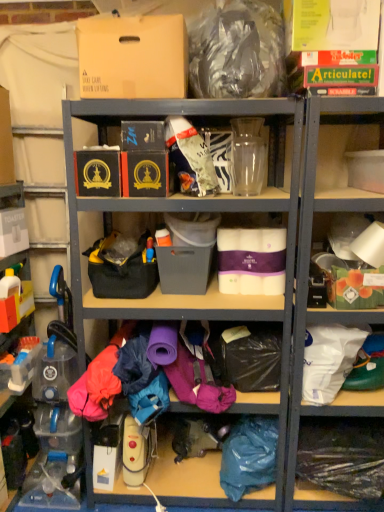
Question: Relative to clear plastic bottles at left, which is counted as the 1th shelf, starting from the left, is matte plastic storage box at center, the third storage box in the right-to-left sequence, in front or behind?

Choices:
 (A) front
 (B) behind

Answer: (B)

Question: Considering the positions of matte plastic storage box at center, the third storage box in the right-to-left sequence, and clear plastic bottles at left, acting as the fifth shelf starting from the right, in the image, is matte plastic storage box at center, the third storage box in the right-to-left sequence, wider or thinner than clear plastic bottles at left, acting as the fifth shelf starting from the right,?

Choices:
 (A) thin
 (B) wide

Answer: (B)

Question: Which object is positioned closest to the matte cardboard box at upper left, the 5th storage box viewed from the right?

Choices:
 (A) clear plastic bottle at lower left, the 2th shelf from the left
 (B) white plastic toaster at left, arranged as the 1th storage box when viewed from the left
 (C) clear plastic bottles at left, which is counted as the 1th shelf, starting from the left
 (D) white paper towel at right, arranged as the fourth shelf when viewed from the left
 (E) matte black box at center, the fourth storage box when ordered from left to right

Answer: (E)

Question: Estimate the real-world distances between objects in this image. Which object is farther from the clear plastic bottles at left, acting as the fifth shelf starting from the right?

Choices:
 (A) matte cardboard box at upper left, the 5th storage box viewed from the right
 (B) matte plastic storage box at center, the third storage box in the right-to-left sequence
 (C) blue fabric at lower right
 (D) clear plastic bag at lower right, the third shelf positioned from the left
 (E) clear plastic bottle at lower left, the 2th shelf from the left

Answer: (D)